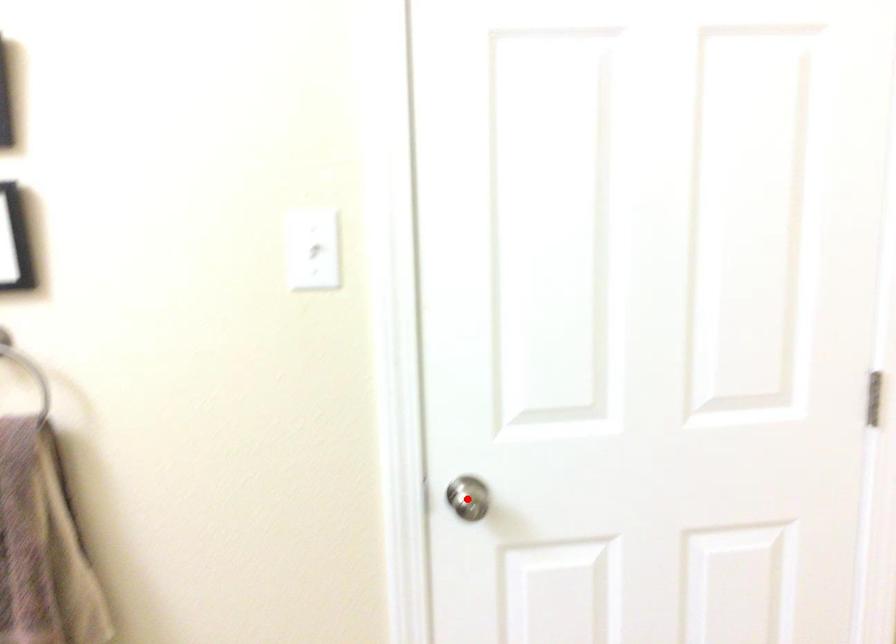
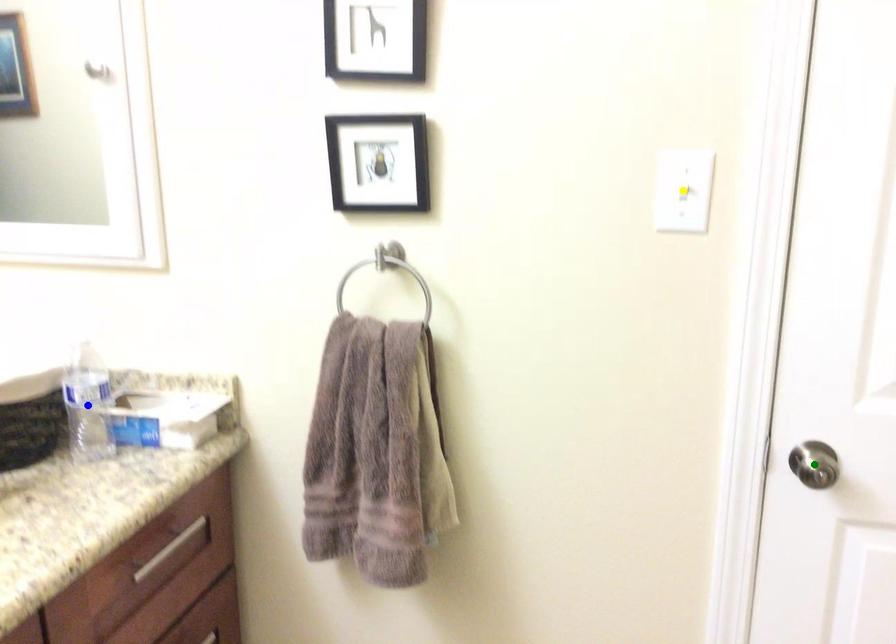
Question: I am providing you with two images of the same scene from different viewpoints. A red point is marked on the first image. You are given multiple points on the second image. Can you choose the point in image 2 that corresponds to the point in image 1?

Choices:
 (A) blue point
 (B) yellow point
 (C) green point

Answer: (C)